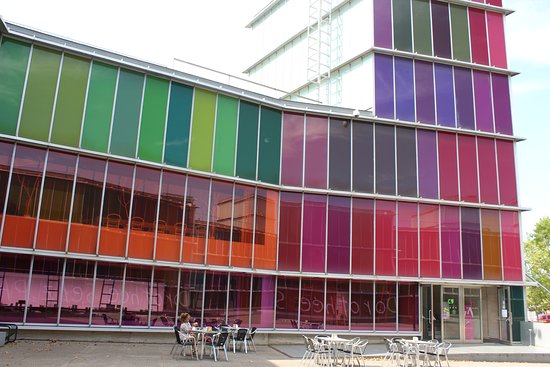
This screenshot has width=550, height=367. In order to click on ladders in this screenshot , I will do `click(507, 46)`, `click(514, 268)`, `click(409, 258)`, `click(427, 257)`, `click(446, 257)`, `click(502, 169)`, `click(323, 49)`.